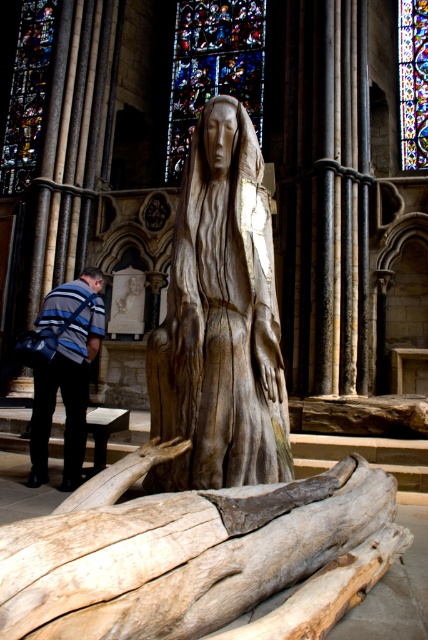
You are standing in the cathedral and want to place a small candle on the light brown wood log at lower center. The point where you want to place it is at coordinates point (x=193, y=556). Is this point on the log?

Yes, the point (x=193, y=556) is on the light brown wood log at lower center, so you can place the candle there.

You are an art student visiting the cathedral and want to sketch the wooden statue at center and the stained glass at upper center. Since you can only focus on one object at a time, which one should you draw first if you want to capture the one that is closer to the front of the cathedral?

The wooden statue at center is positioned on the left side of stained glass at upper center, so it is closer to the front of the cathedral. Therefore, you should draw the wooden statue at center first.